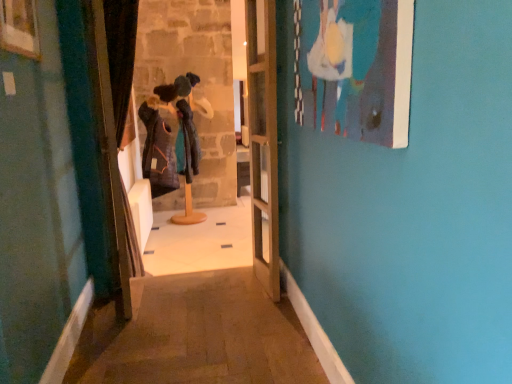
Question: Considering the positions of matte blue painting at upper right, the 1th picture frame viewed from the right, and clear glass door at center in the image, is matte blue painting at upper right, the 1th picture frame viewed from the right, bigger or smaller than clear glass door at center?

Choices:
 (A) big
 (B) small

Answer: (B)

Question: Is matte blue painting at upper right, the 1th picture frame viewed from the right, wider or thinner than clear glass door at center?

Choices:
 (A) wide
 (B) thin

Answer: (B)

Question: Based on their relative distances, which object is nearer to the knitted woolen hat at center?

Choices:
 (A) velvet dark brown curtain at left
 (B) clear glass door at center
 (C) matte blue painting at upper right, which appears as the second picture frame when viewed from the left
 (D) wooden picture frame at upper left, acting as the 1th picture frame starting from the left

Answer: (A)

Question: Which object is the farthest from the clear glass door at center?

Choices:
 (A) knitted woolen hat at center
 (B) matte blue painting at upper right, the 1th picture frame viewed from the right
 (C) velvet dark brown curtain at left
 (D) wooden picture frame at upper left, acting as the 1th picture frame starting from the left

Answer: (A)